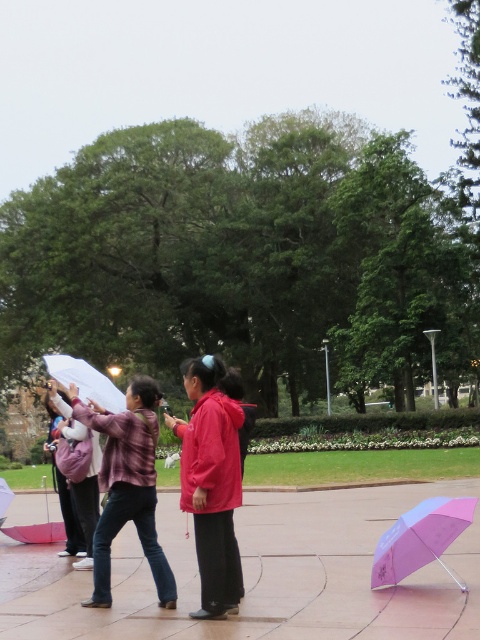
Question: Does white matte umbrella at upper left come in front of matte red coat at center?

Choices:
 (A) no
 (B) yes

Answer: (A)

Question: Which point is closer to the camera taking this photo?

Choices:
 (A) (228, 493)
 (B) (57, 468)

Answer: (A)

Question: Which point is closer to the camera?

Choices:
 (A) (224, 378)
 (B) (70, 520)

Answer: (A)

Question: Which point appears closest to the camera in this image?

Choices:
 (A) (3, 528)
 (B) (408, 560)

Answer: (B)

Question: Is matte red coat at center to the right of white matte umbrella at center from the viewer's perspective?

Choices:
 (A) no
 (B) yes

Answer: (B)

Question: Does matte purple jacket at center have a larger size compared to matte purple umbrella at left?

Choices:
 (A) no
 (B) yes

Answer: (A)